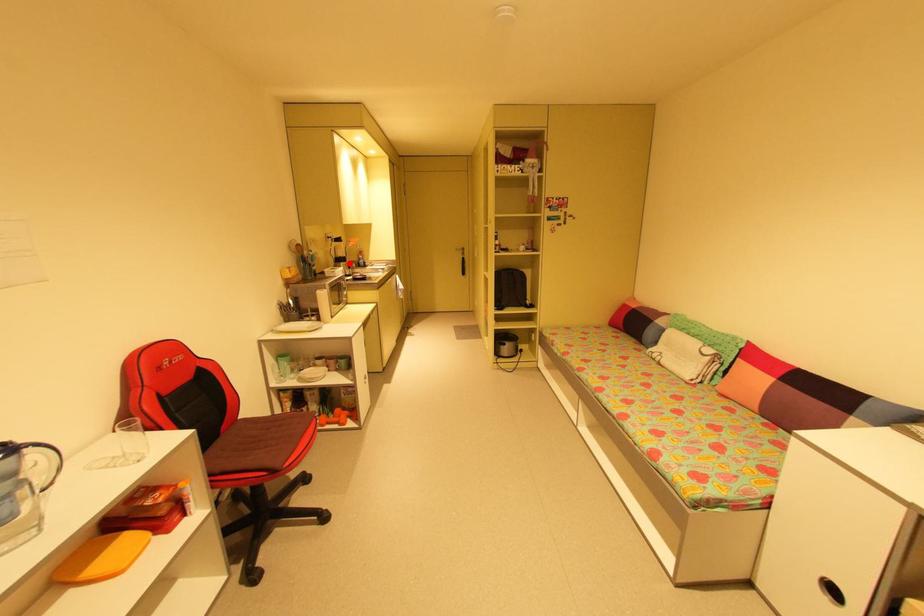
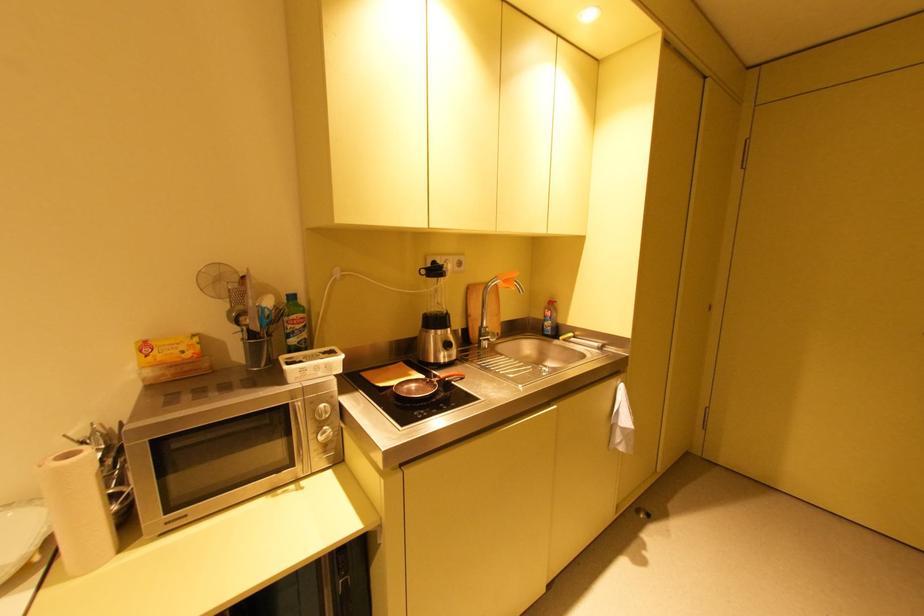
The point at the highlighted location is marked in the first image. Where is the corresponding point in the second image?

(444, 331)